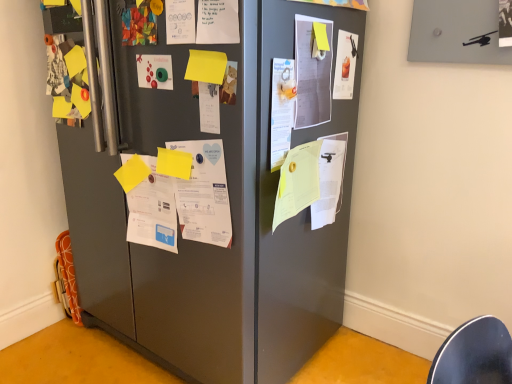
Question: Is yellow matte paper at center-left, positioned as the 1th paper in left-to-right order, spatially inside white paper at center, the sixth poster viewed from the left, or outside of it?

Choices:
 (A) outside
 (B) inside

Answer: (A)

Question: Is yellow matte paper at center-left, placed as the 6th paper when sorted from right to left, taller or shorter than white paper at center, the sixth poster viewed from the left?

Choices:
 (A) tall
 (B) short

Answer: (B)

Question: Which object is positioned closest to the yellow matte paper at center, the 3th paper when ordered from left to right?

Choices:
 (A) white paper at center, arranged as the fifth poster when viewed from the right
 (B) yellow paper at center, the 2th paper positioned from the right
 (C) white paper at center, marked as the 2th paper in a left-to-right arrangement
 (D) white paper at center, placed as the 5th poster when sorted from left to right
 (E) white paper at right, marked as the sixth paper in a left-to-right arrangement

Answer: (A)

Question: Which of these objects is positioned farthest from the yellow matte paper at center-left, positioned as the 1th paper in left-to-right order?

Choices:
 (A) white paper at center, the 4th poster from the right
 (B) matte paper poster at upper right, the 1th poster positioned from the right
 (C) white paper at upper center, positioned as the 2th poster in left-to-right order
 (D) white paper at center, which is the third poster in left-to-right order
 (E) yellow paper at center, which appears as the fifth paper when viewed from the left

Answer: (B)